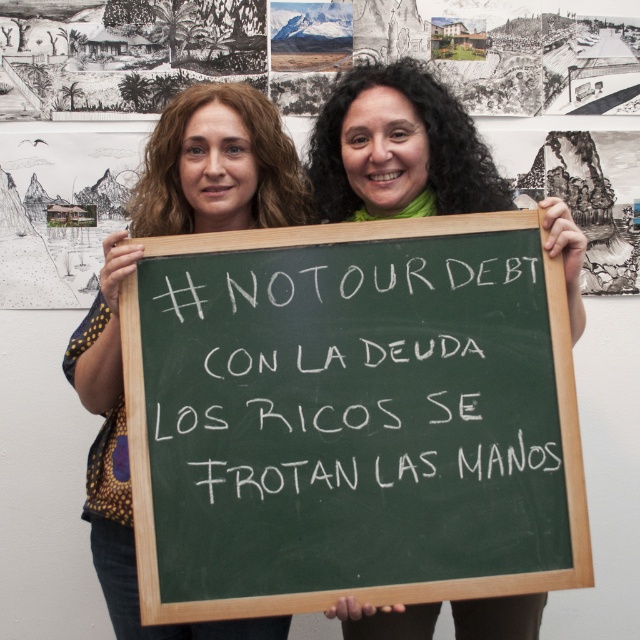
Question: Does matte black board at center appear under green fabric scarf at center?

Choices:
 (A) yes
 (B) no

Answer: (A)

Question: Which of the following is the closest to the observer?

Choices:
 (A) (112, 529)
 (B) (365, 452)
 (C) (576, 323)

Answer: (B)

Question: Can you confirm if green chalkboard at center is thinner than matte black board at center?

Choices:
 (A) no
 (B) yes

Answer: (A)

Question: Among these objects, which one is nearest to the camera?

Choices:
 (A) green fabric scarf at center
 (B) green chalkboard at center
 (C) matte black board at center

Answer: (B)

Question: Does green chalkboard at center have a larger size compared to matte black board at center?

Choices:
 (A) yes
 (B) no

Answer: (B)

Question: Based on their relative distances, which object is farther from the green fabric scarf at center?

Choices:
 (A) matte black board at center
 (B) green chalkboard at center

Answer: (B)